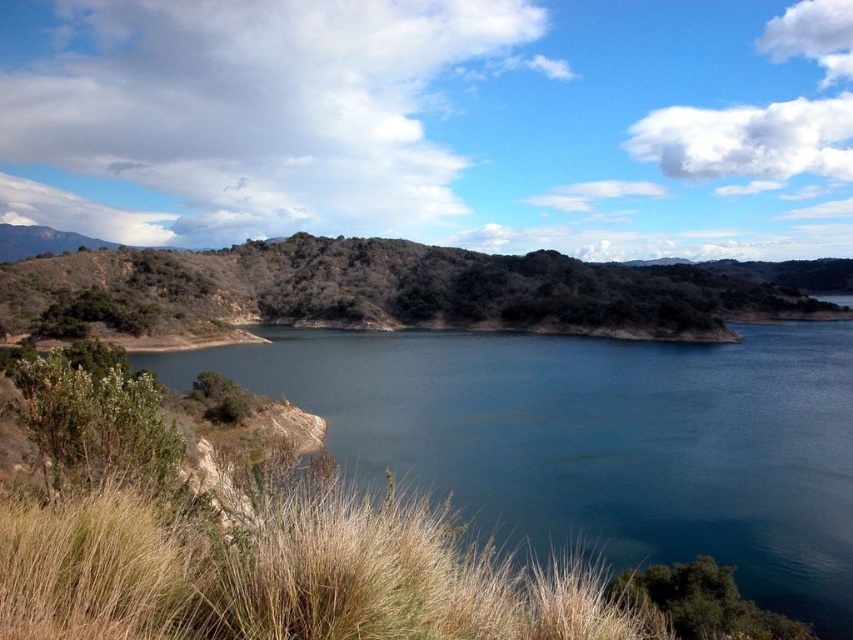
You are standing at the edge of the lake and want to walk to both points marked in the image. Which point, point (461, 401) or point (463, 260), will you reach first if you start walking directly towards them?

You will reach point (461, 401) first because it is closer to the viewer than point (463, 260).

You are standing at the point marked by the coordinate point at the center of the image, which is point (599,440). You want to walk towards the golden grasses in the foreground. Which direction should you head?

The blue water at center is represented by point (599,440). Since the golden grasses are in the foreground, you should walk towards the direction away from the water towards the front of the image.

You are standing at the edge of the scene and want to determine which object occupies more vertical space in the image. Based on the scene, which one is taller between the blue water at center and the dry grass at lower left?

The blue water at center is taller than the dry grass at lower left according to the description.